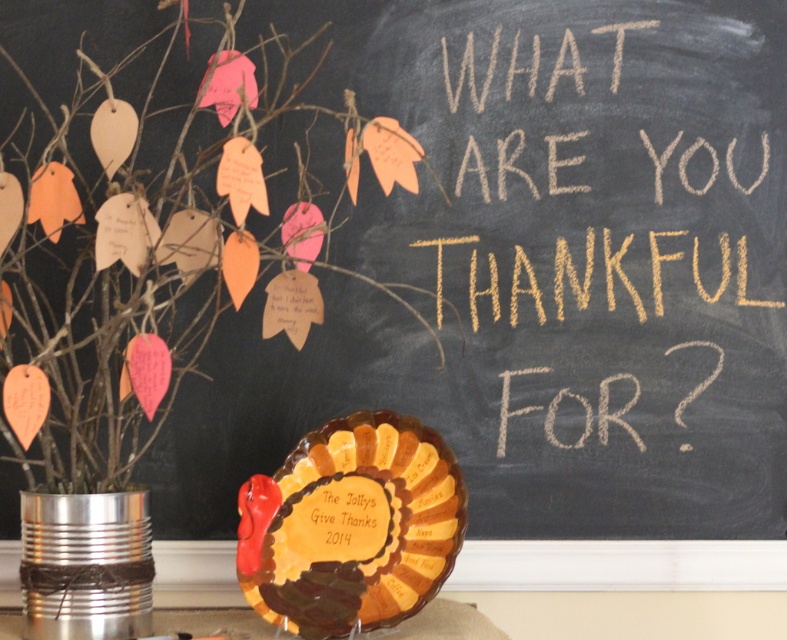
From the picture: Does chalk/blackboard at upper center have a lesser height compared to metallic tin can at lower left?

No, chalk/blackboard at upper center is not shorter than metallic tin can at lower left.

What do you see at coordinates (471, 72) in the screenshot? The width and height of the screenshot is (787, 640). I see `chalk/blackboard at upper center` at bounding box center [471, 72].

The width and height of the screenshot is (787, 640). Describe the element at coordinates (471, 72) in the screenshot. I see `chalk/blackboard at upper center` at that location.

Identify the location of chalk/blackboard at upper center. The height and width of the screenshot is (640, 787). (471, 72).

Between brown glossy turkey plate at center and chalk/blackboard at upper center, which one appears on the right side from the viewer's perspective?

From the viewer's perspective, chalk/blackboard at upper center appears more on the right side.

Does brown glossy turkey plate at center have a smaller size compared to chalk/blackboard at upper center?

No.

Between point (324, 454) and point (608, 268), which one is positioned in front?

Point (324, 454) is more forward.

I want to click on brown glossy turkey plate at center, so click(350, 525).

Is the position of brown glossy turkey plate at center less distant than that of metallic tin can at lower left?

No, it is not.

Can you confirm if brown glossy turkey plate at center is positioned to the right of metallic tin can at lower left?

Yes, brown glossy turkey plate at center is to the right of metallic tin can at lower left.

Which is in front, point (276, 531) or point (191, 630)?

Point (191, 630) is more forward.

At what (x,y) coordinates should I click in order to perform the action: click on brown glossy turkey plate at center. Please return your answer as a coordinate pair (x, y). The height and width of the screenshot is (640, 787). Looking at the image, I should click on point(350,525).